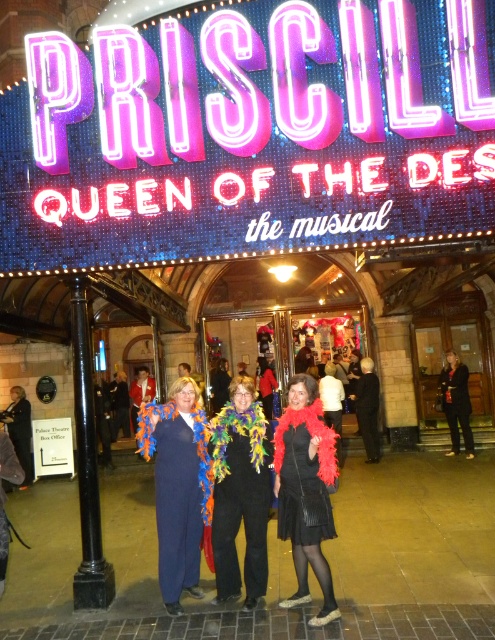
Question: Does velvet red scarf at center appear under black polished metal pole at left?

Choices:
 (A) no
 (B) yes

Answer: (B)

Question: Which of the following is the closest to the observer?

Choices:
 (A) black textured dress at center
 (B) velvet red scarf at center
 (C) blue velvet scarf at center

Answer: (B)

Question: From the image, what is the correct spatial relationship of blue velvet scarf at center in relation to velvet red scarf at center?

Choices:
 (A) left
 (B) right

Answer: (A)

Question: Which point is farther to the camera?

Choices:
 (A) (154, 445)
 (B) (253, 604)
 (C) (284, 602)
 (D) (302, 484)

Answer: (A)

Question: Which point appears farthest from the camera in this image?

Choices:
 (A) (237, 516)
 (B) (167, 564)

Answer: (A)

Question: Does blue velvet scarf at center appear over black textured dress at center?

Choices:
 (A) yes
 (B) no

Answer: (B)